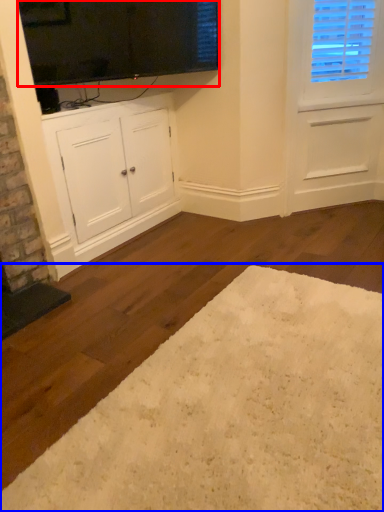
Question: Which point is further to the camera, window screen (highlighted by a red box) or plain (highlighted by a blue box)?

Choices:
 (A) window screen
 (B) plain

Answer: (A)